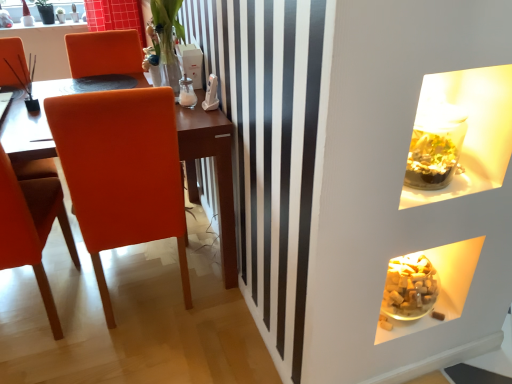
Question: Is matte orange chair at left, which is the first chair from left to right, thinner than translucent glass vase at upper center?

Choices:
 (A) yes
 (B) no

Answer: (B)

Question: Does matte orange chair at left, which is the first chair from left to right, appear on the right side of translucent glass vase at upper center?

Choices:
 (A) yes
 (B) no

Answer: (B)

Question: Is matte orange chair at left, which is the first chair from left to right, far away from translucent glass vase at upper center?

Choices:
 (A) no
 (B) yes

Answer: (A)

Question: From the image's perspective, would you say matte orange chair at left, which is the second chair in right-to-left order, is positioned over translucent glass vase at upper center?

Choices:
 (A) yes
 (B) no

Answer: (B)

Question: From a real-world perspective, is matte orange chair at left, which is the second chair in right-to-left order, below translucent glass vase at upper center?

Choices:
 (A) no
 (B) yes

Answer: (B)

Question: Can you confirm if matte orange chair at left, which is the second chair in right-to-left order, is shorter than translucent glass vase at upper center?

Choices:
 (A) no
 (B) yes

Answer: (A)

Question: Considering the relative sizes of orange leather chair at left, arranged as the 1th chair when viewed from the right, and matte orange chair at left, which is the first chair from left to right, in the image provided, is orange leather chair at left, arranged as the 1th chair when viewed from the right, taller than matte orange chair at left, which is the first chair from left to right,?

Choices:
 (A) no
 (B) yes

Answer: (B)

Question: Can you confirm if orange leather chair at left, arranged as the 1th chair when viewed from the right, is thinner than matte orange chair at left, which is the second chair in right-to-left order?

Choices:
 (A) no
 (B) yes

Answer: (A)

Question: From a real-world perspective, is orange leather chair at left, which is counted as the second chair, starting from the left, beneath matte orange chair at left, which is the first chair from left to right?

Choices:
 (A) no
 (B) yes

Answer: (A)

Question: Is orange leather chair at left, which is counted as the second chair, starting from the left, positioned behind matte orange chair at left, which is the second chair in right-to-left order?

Choices:
 (A) no
 (B) yes

Answer: (B)

Question: Is orange leather chair at left, which is counted as the second chair, starting from the left, surrounding matte orange chair at left, which is the first chair from left to right?

Choices:
 (A) yes
 (B) no

Answer: (B)

Question: Is orange leather chair at left, arranged as the 1th chair when viewed from the right, far from matte orange chair at left, which is the first chair from left to right?

Choices:
 (A) no
 (B) yes

Answer: (A)

Question: Is orange leather chair at left, arranged as the 1th chair when viewed from the right, further to camera compared to translucent glass cubes at lower right, which appears as the 2th food when viewed from the right?

Choices:
 (A) yes
 (B) no

Answer: (B)